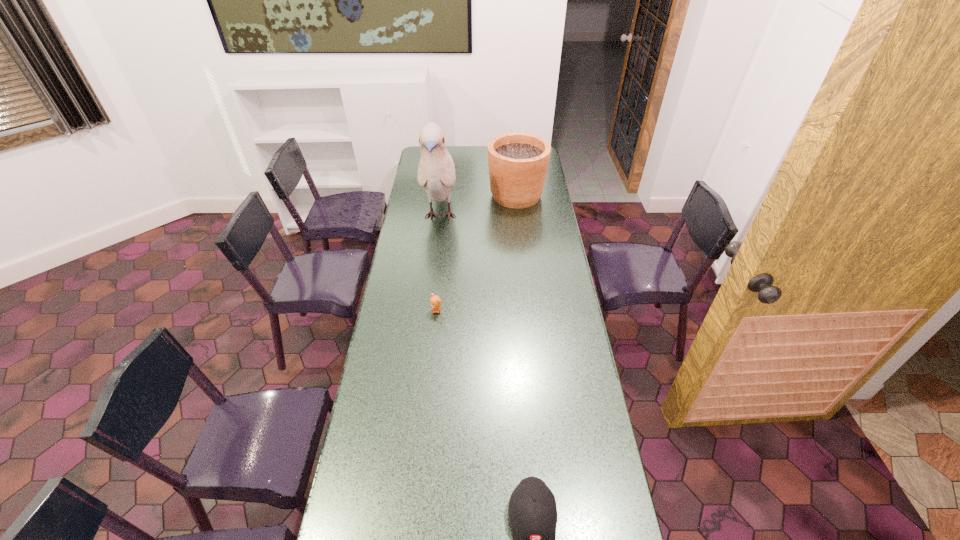
Find the location of `vacant space at the left edge of the desktop`. vacant space at the left edge of the desktop is located at coordinates (416, 382).

Where is `vacant space at the right edge of the desktop`? vacant space at the right edge of the desktop is located at coordinates (592, 467).

Where is `empty location between the tallest object and the second tallest object`? empty location between the tallest object and the second tallest object is located at coordinates (478, 206).

Locate an element on the screen. The width and height of the screenshot is (960, 540). blank region between the parakeet and the third farthest object is located at coordinates (439, 263).

The width and height of the screenshot is (960, 540). I want to click on free spot between the second nearest object and the parakeet, so click(439, 263).

Locate an element on the screen. vacant area between the parakeet and the flowerpot is located at coordinates (478, 206).

Locate an element on the screen. The width and height of the screenshot is (960, 540). free point between the shortest object and the parakeet is located at coordinates (439, 263).

In order to click on free space that is in between the tallest object and the teddy bear in this screenshot , I will do `click(439, 263)`.

Where is `vacant space in between the teddy bear and the parakeet`? vacant space in between the teddy bear and the parakeet is located at coordinates (439, 263).

This screenshot has height=540, width=960. I want to click on object that is the nearest to the second shortest object, so click(435, 301).